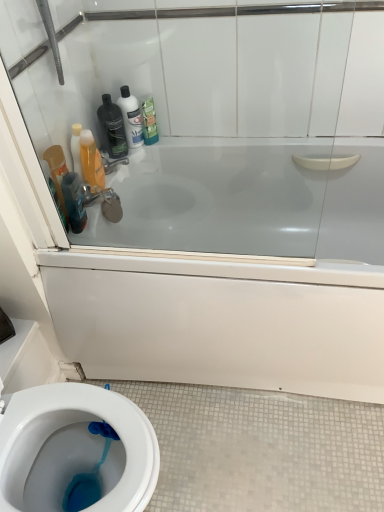
Where is `free location in front of translucent plastic mouthwash at left, positioned as the first mouthwash in right-to-left order`? This screenshot has height=512, width=384. free location in front of translucent plastic mouthwash at left, positioned as the first mouthwash in right-to-left order is located at coordinates (83, 251).